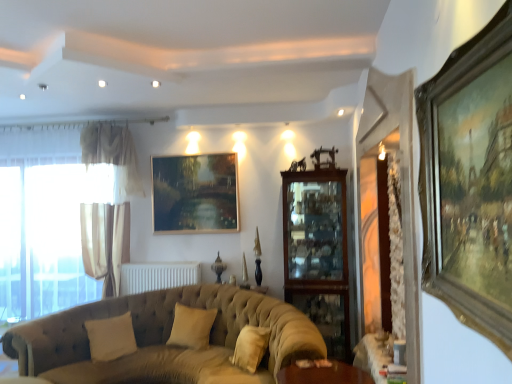
Question: Is white sheer curtains at left inside or outside of tufted fabric couch at lower left?

Choices:
 (A) outside
 (B) inside

Answer: (A)

Question: From the image's perspective, is white sheer curtains at left located above or below tufted fabric couch at lower left?

Choices:
 (A) above
 (B) below

Answer: (A)

Question: Estimate the real-world distances between objects in this image. Which object is closer to the beige fabric curtain at left?

Choices:
 (A) gold-toned wooden picture frame at right, which appears as the 1th picture frame when viewed from the front
 (B) beige fabric pillow at lower left, which appears as the 1th pillow when viewed from the left
 (C) beige fabric pillow at center, which appears as the first pillow when viewed from the right
 (D) oil painting at center, the second picture frame when ordered from front to back
 (E) wooden table at lower right

Answer: (D)

Question: Which is nearer to the white sheer curtains at left?

Choices:
 (A) gold-toned wooden picture frame at right, which ranks as the 2th picture frame in back-to-front order
 (B) beige fabric curtain at left
 (C) white matte radiator at center
 (D) beige fabric pillow at center, which appears as the first pillow when viewed from the right
 (E) beige fabric pillow at lower left, which appears as the 1th pillow when viewed from the left

Answer: (B)